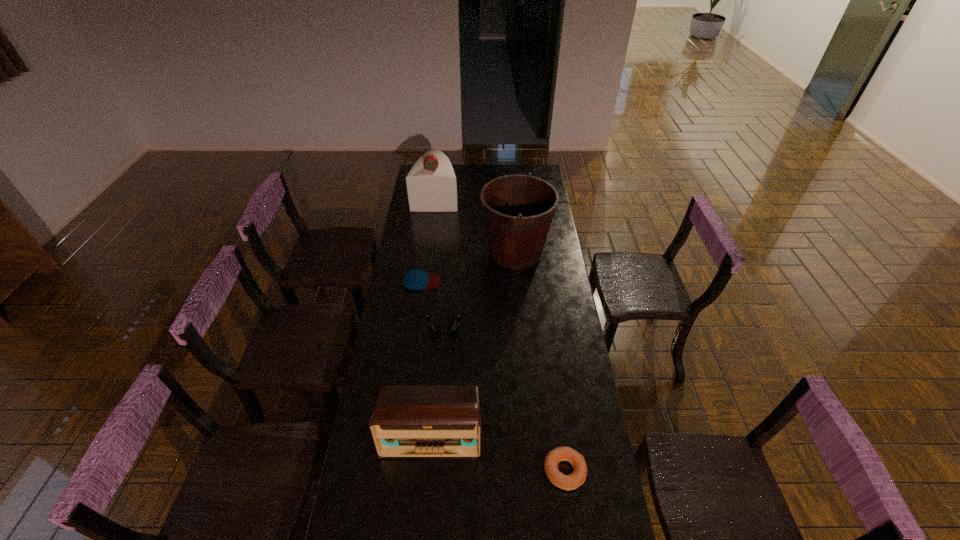
At what (x,y) coordinates should I click in order to perform the action: click on free area in between the third nearest object and the third tallest object. Please return your answer as a coordinate pair (x, y). Image resolution: width=960 pixels, height=540 pixels. Looking at the image, I should click on (438, 383).

Where is `free space between the bucket and the headset`? The image size is (960, 540). free space between the bucket and the headset is located at coordinates (480, 291).

Find the location of a particular element. This screenshot has width=960, height=540. free spot between the bucket and the fourth shortest object is located at coordinates (473, 345).

At what (x,y) coordinates should I click in order to perform the action: click on free space between the baseball cap and the third shortest object. Please return your answer as a coordinate pair (x, y). Looking at the image, I should click on (433, 306).

Find the location of a particular element. object that stands as the fourth closest to the cake is located at coordinates (408, 422).

Find the location of a particular element. The image size is (960, 540). object that is the fourth closest to the fourth tallest object is located at coordinates (567, 482).

You are a GUI agent. You are given a task and a screenshot of the screen. Output one action in this format:
    pyautogui.click(x=<x>, y=<y>)
    Task: Click on the vacant point that satisfies the following two spatial constraints: 1. on the ear cups of the bagel; 2. on the left side of the third shortest object
    
    Given the screenshot: What is the action you would take?
    pyautogui.click(x=434, y=471)

The height and width of the screenshot is (540, 960). In order to click on vacant point that satisfies the following two spatial constraints: 1. with the bill of the bagel facing forward; 2. on the right side of the baseball cap in this screenshot , I will do `click(395, 471)`.